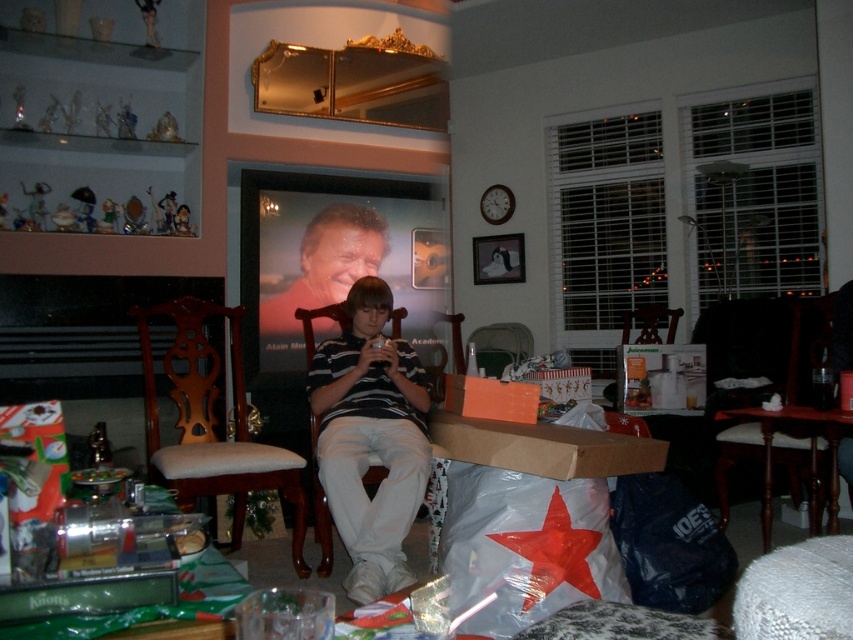
You are organizing a small party and need to place a decorative centerpiece on the table. The striped cotton shirt at center and the wooden armchair at lower right are in the way. Which object should you move to free up more space?

You should move the wooden armchair at lower right because it occupies more space than the striped cotton shirt at center.

What is located at the coordinates point [370,438]?

The striped cotton shirt at center is located at point [370,438].

You are organizing the living room and need to place the striped cotton shirt at center and the brown cardboard box at center. According to the scene, where should you position them relative to each other?

The striped cotton shirt at center should be placed below the brown cardboard box at center as per the scene description.